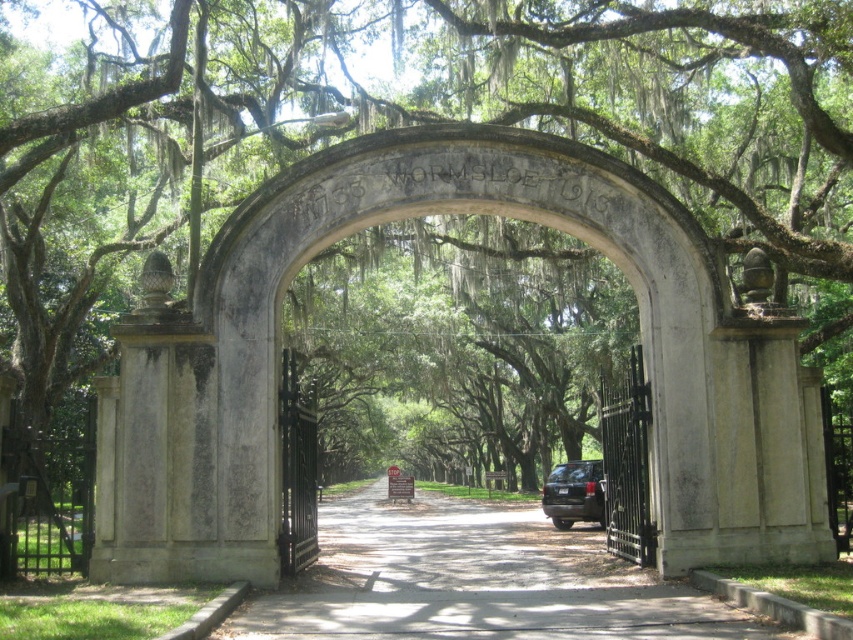
Question: Which of the following is the closest to the observer?

Choices:
 (A) smooth asphalt driveway at center
 (B) shiny black suv at center

Answer: (A)

Question: Among these points, which one is farthest from the camera?

Choices:
 (A) (563, 540)
 (B) (560, 500)

Answer: (B)

Question: Where is smooth asphalt driveway at center located in relation to shiny black suv at center in the image?

Choices:
 (A) left
 (B) right

Answer: (A)

Question: Which point is farther to the camera?

Choices:
 (A) smooth asphalt driveway at center
 (B) shiny black suv at center

Answer: (B)

Question: Considering the relative positions of smooth asphalt driveway at center and shiny black suv at center in the image provided, where is smooth asphalt driveway at center located with respect to shiny black suv at center?

Choices:
 (A) above
 (B) below

Answer: (B)

Question: Can you confirm if smooth asphalt driveway at center is positioned above shiny black suv at center?

Choices:
 (A) no
 (B) yes

Answer: (A)